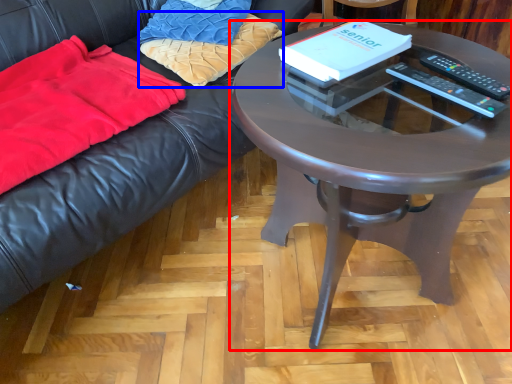
Question: Which point is further to the camera, coffee table (highlighted by a red box) or pillow (highlighted by a blue box)?

Choices:
 (A) coffee table
 (B) pillow

Answer: (B)